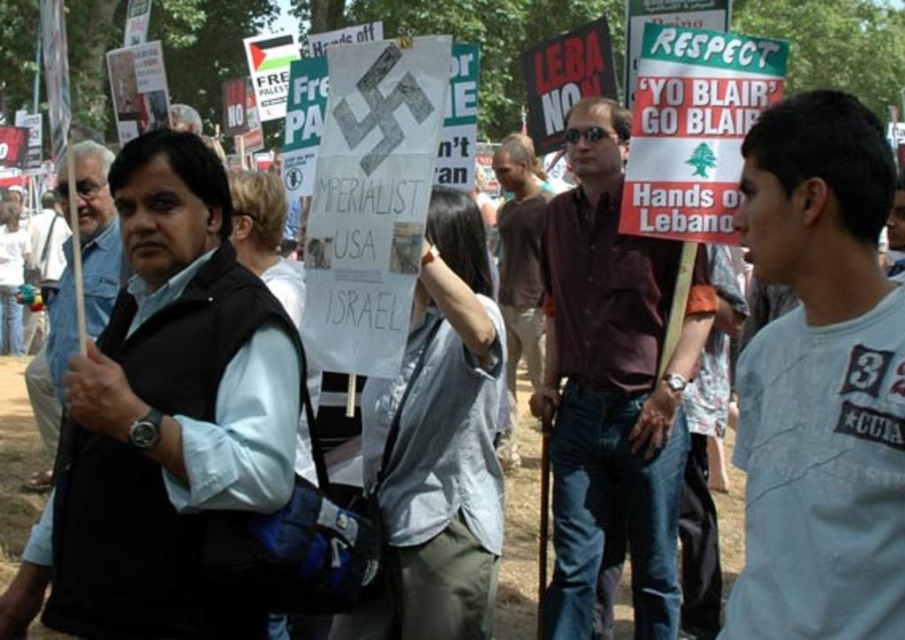
Which is behind, point (574, 413) or point (173, 484)?

The point (574, 413) is behind.

The height and width of the screenshot is (640, 905). I want to click on dark brown shirt at center, so 612,390.

What are the coordinates of `dark brown shirt at center` in the screenshot? It's located at (612, 390).

Which is more to the right, dark brown shirt at center or black vest at left?

dark brown shirt at center

Is dark brown shirt at center to the left of black vest at left from the viewer's perspective?

In fact, dark brown shirt at center is to the right of black vest at left.

Where is `dark brown shirt at center`? This screenshot has width=905, height=640. dark brown shirt at center is located at coordinates (612, 390).

Which is below, white cotton t-shirt at center or black vest at left?

white cotton t-shirt at center is lower down.

How far apart are white cotton t-shirt at center and black vest at left?

white cotton t-shirt at center and black vest at left are 5.72 meters apart.

The width and height of the screenshot is (905, 640). I want to click on white cotton t-shirt at center, so click(820, 381).